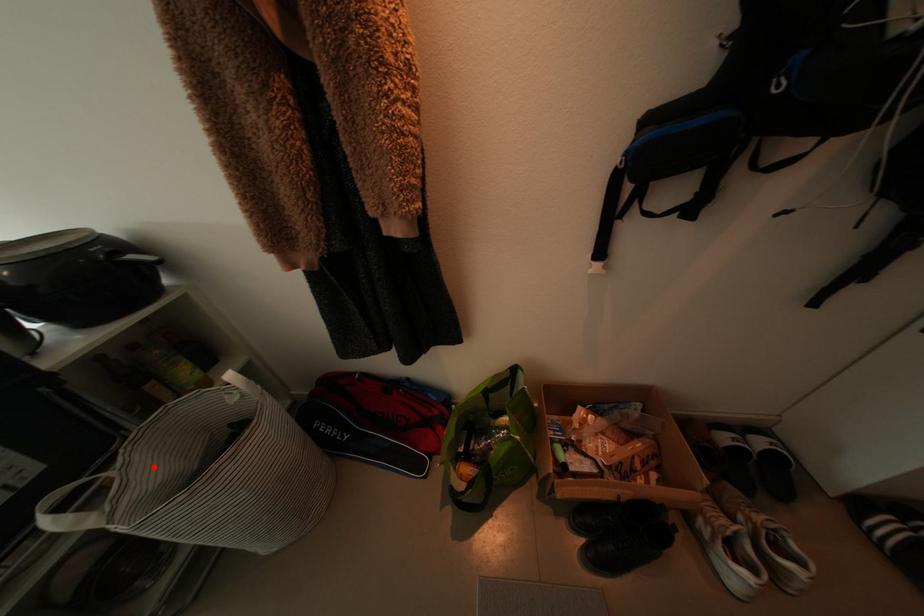
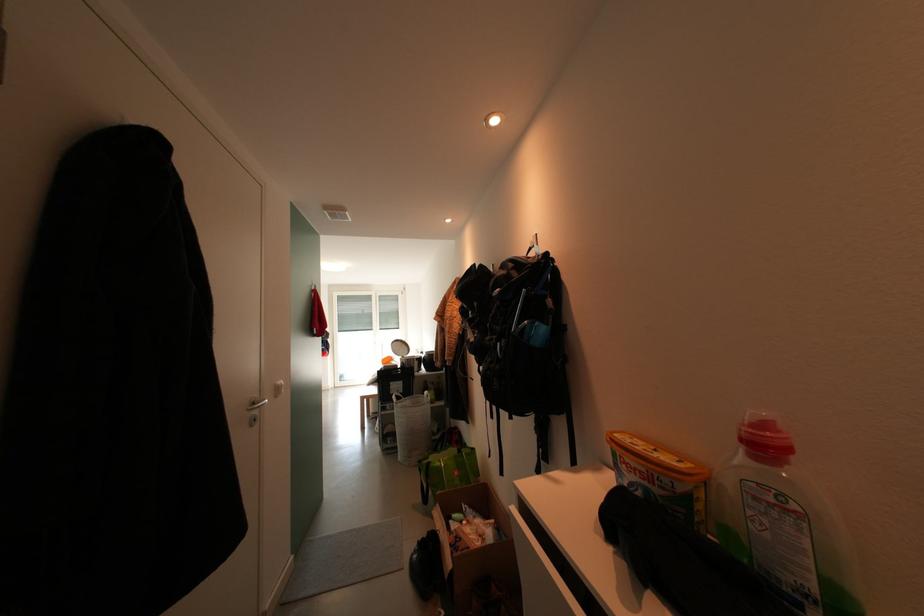
Question: I am providing you with two images of the same scene from different viewpoints. A red point is shown in image1. For the corresponding object point in image2, is it positioned nearer or farther from the camera?

Choices:
 (A) Nearer
 (B) Farther

Answer: (B)